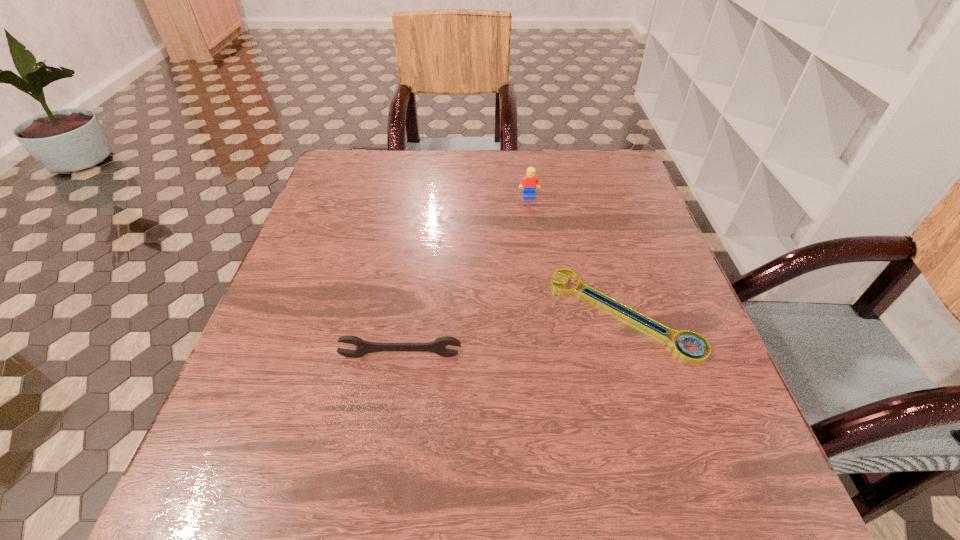
Find the location of a particular element. Image resolution: width=960 pixels, height=540 pixels. object at the left edge is located at coordinates (438, 346).

I want to click on object that is at the right edge, so click(618, 309).

Where is `blank space at the far edge`? blank space at the far edge is located at coordinates (544, 150).

I want to click on free location at the left edge, so click(x=258, y=375).

Find the location of a particular element. This screenshot has width=960, height=540. vacant point at the right edge is located at coordinates (647, 220).

This screenshot has width=960, height=540. What are the coordinates of `vacant space at the far left corner of the desktop` in the screenshot? It's located at (345, 169).

This screenshot has height=540, width=960. In the image, there is a desktop. What are the coordinates of `vacant space at the near left corner` in the screenshot? It's located at (273, 524).

Identify the location of free space at the far right corner of the desktop. (572, 160).

In the image, there is a desktop. Where is `vacant region at the near right corner`? The width and height of the screenshot is (960, 540). vacant region at the near right corner is located at coordinates (688, 507).

You are a GUI agent. You are given a task and a screenshot of the screen. Output one action in this format:
    pyautogui.click(x=<x>, y=<y>)
    Task: Click on the vacant region between the tallest object and the leftmost object
    This screenshot has height=540, width=960.
    Given the screenshot: What is the action you would take?
    pyautogui.click(x=465, y=276)